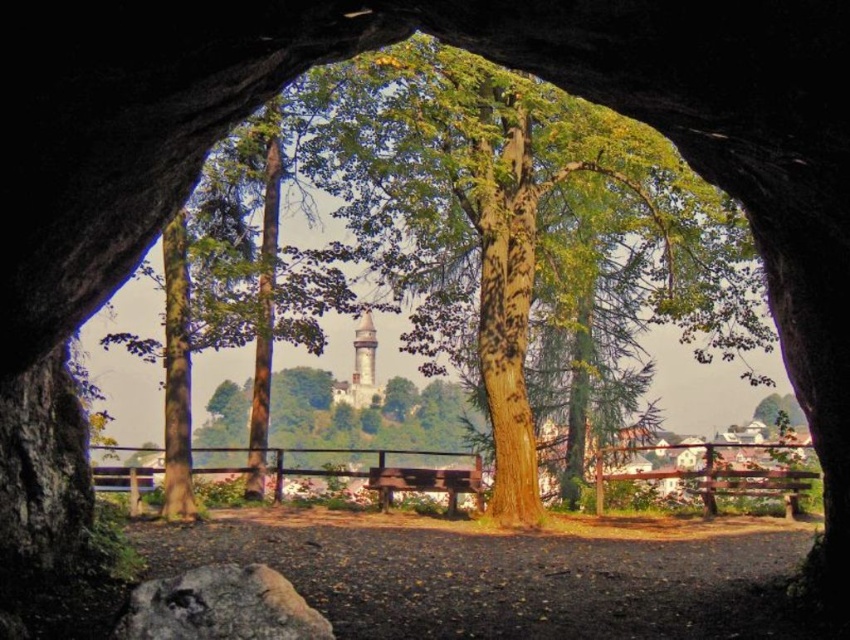
Question: Does green rough bark tree at center have a larger size compared to stone tower at center?

Choices:
 (A) no
 (B) yes

Answer: (B)

Question: Which object is positioned closest to the green rough bark tree at center?

Choices:
 (A) stone tower at center
 (B) wooden park bench at center

Answer: (B)

Question: Can you confirm if green rough bark tree at center is positioned below stone tower at center?

Choices:
 (A) no
 (B) yes

Answer: (A)

Question: Is green rough bark tree at center to the left of stone tower at center from the viewer's perspective?

Choices:
 (A) no
 (B) yes

Answer: (A)

Question: Among these points, which one is farthest from the camera?

Choices:
 (A) (360, 346)
 (B) (449, 504)

Answer: (A)

Question: Estimate the real-world distances between objects in this image. Which object is farther from the wooden park bench at center?

Choices:
 (A) green rough bark tree at center
 (B) stone tower at center

Answer: (A)